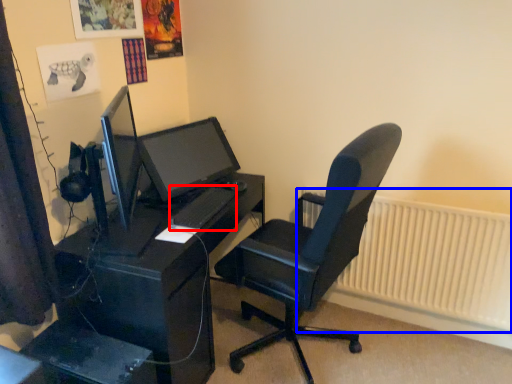
Question: Which point is closer to the camera, keyboard (highlighted by a red box) or radiator (highlighted by a blue box)?

Choices:
 (A) keyboard
 (B) radiator

Answer: (A)